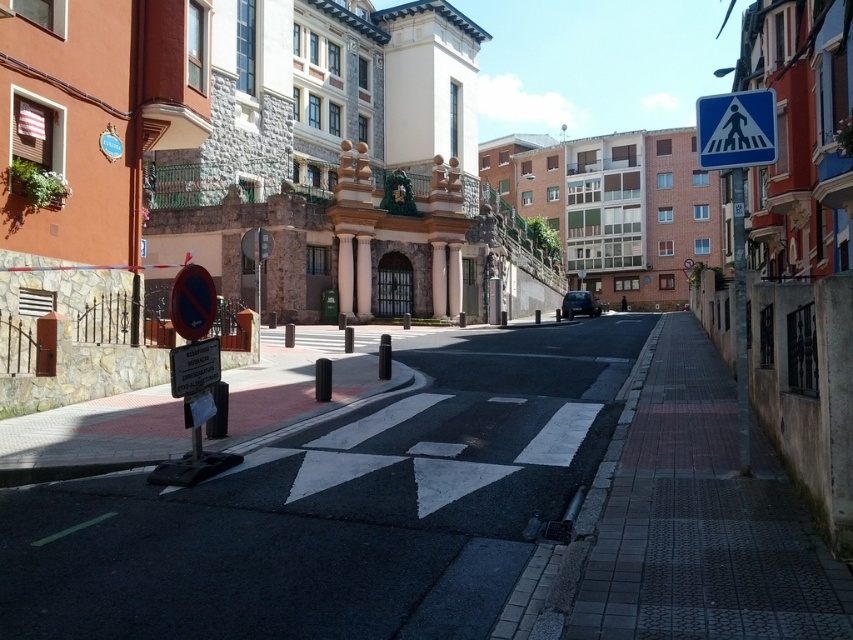
You are a delivery driver approaching the intersection and need to know if the white plastic pedestrian crossing sign at upper right is taller than the dark gray metallic car at center. Based on the scene, can you confirm this?

The white plastic pedestrian crossing sign at upper right is much taller than the dark gray metallic car at center, so yes, the sign is taller than the car.

You are standing at the corner of the street and want to walk towards the two points marked in the image. Which point, point (x=699, y=99) or point (x=579, y=308), will you reach first?

You will reach point (x=699, y=99) first because it is closer to the viewer than point (x=579, y=308).